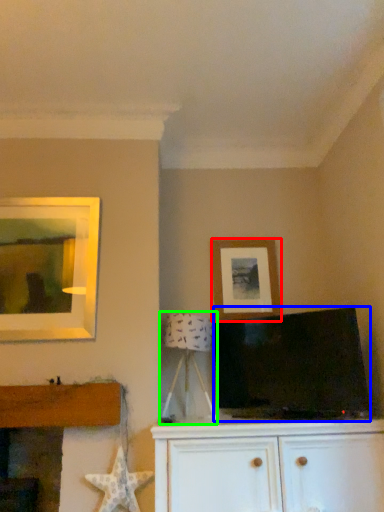
Question: Considering the real-world distances, which object is farthest from picture frame (highlighted by a red box)? television (highlighted by a blue box) or table lamp (highlighted by a green box)?

Choices:
 (A) television
 (B) table lamp

Answer: (A)